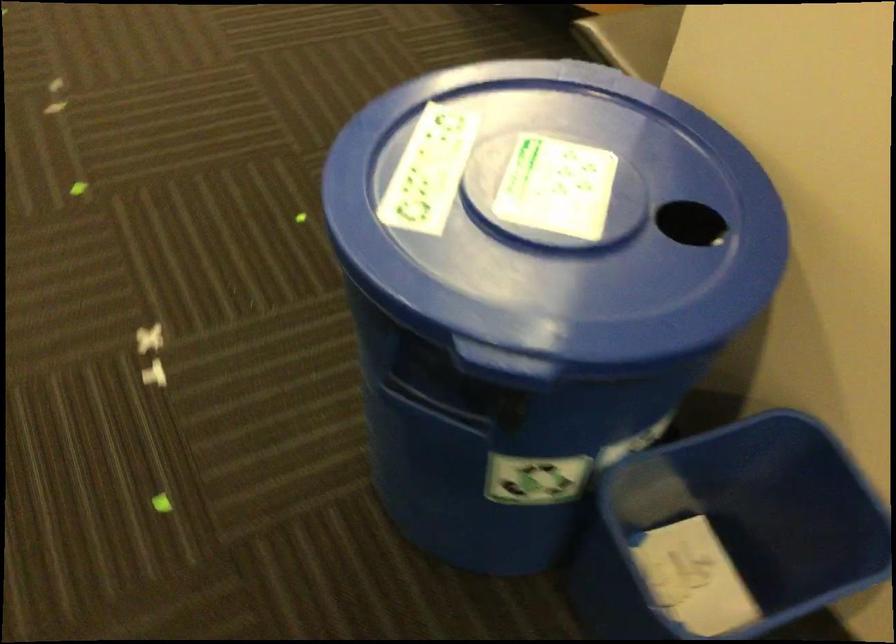
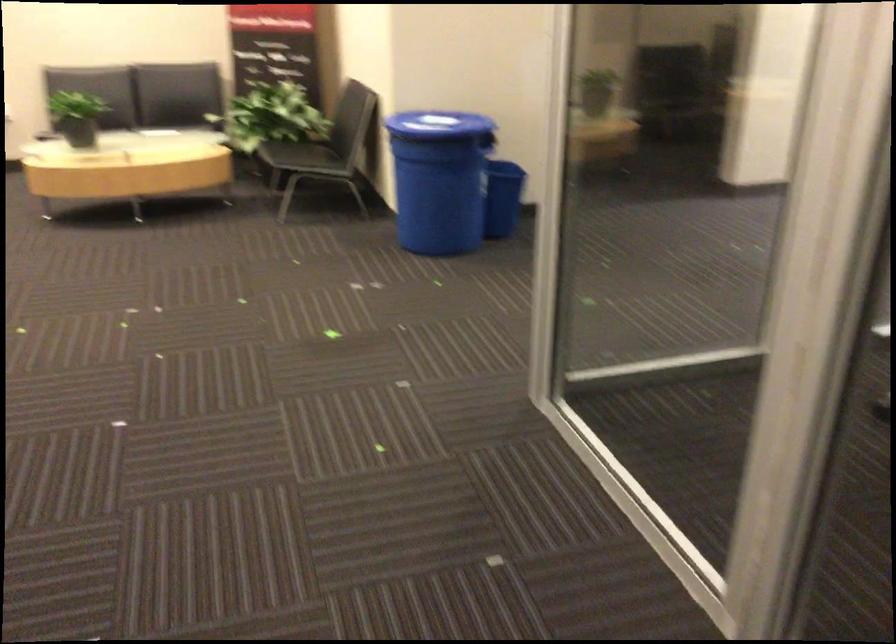
Where in the second image is the point corresponding to point (546, 567) from the first image?

(502, 198)